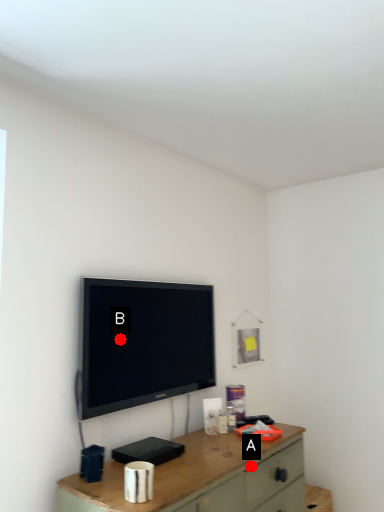
Question: Two points are circled on the image, labeled by A and B beside each circle. Which point appears farthest from the camera in this image?

Choices:
 (A) A is further
 (B) B is further

Answer: (B)